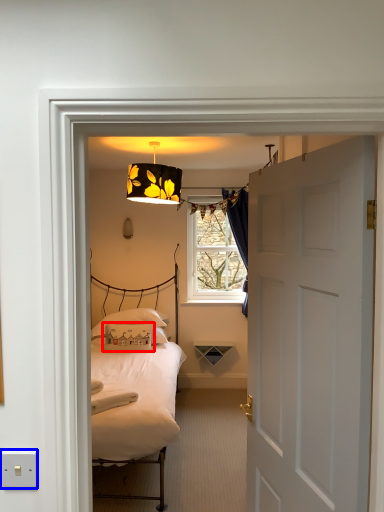
Question: Which point is further to the camera, pillow (highlighted by a red box) or electric outlet (highlighted by a blue box)?

Choices:
 (A) pillow
 (B) electric outlet

Answer: (A)